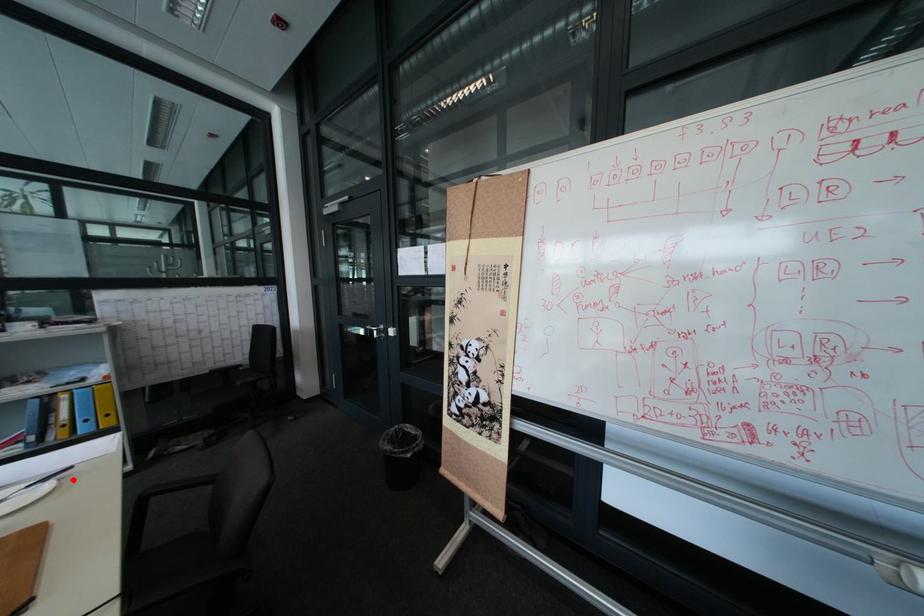
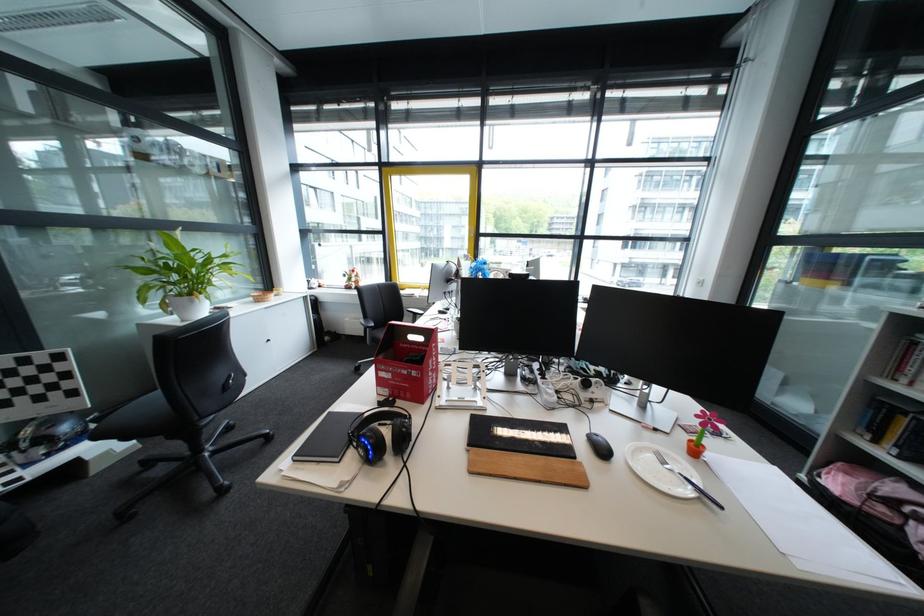
Locate, in the second image, the point that corresponds to the highlighted location in the first image.

(712, 501)